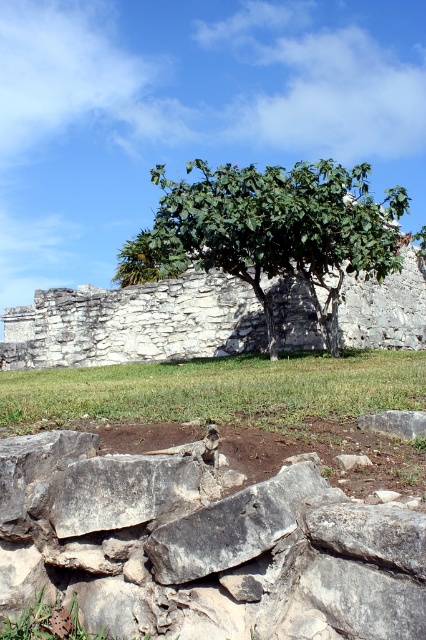
Question: Is green leafy tree at center above white stone ruins at center?

Choices:
 (A) no
 (B) yes

Answer: (B)

Question: Is gray rough stone at center smaller than white stone ruins at center?

Choices:
 (A) no
 (B) yes

Answer: (B)

Question: Can you confirm if gray rough stone at center is bigger than white stone ruins at center?

Choices:
 (A) yes
 (B) no

Answer: (B)

Question: Which point is farther to the camera?

Choices:
 (A) white stone ruins at center
 (B) gray rough stone at center

Answer: (A)

Question: Which point is farther from the camera taking this photo?

Choices:
 (A) (382, 632)
 (B) (201, 307)

Answer: (B)

Question: Which point is farther from the camera taking this photo?

Choices:
 (A) (137, 636)
 (B) (184, 326)
 (C) (377, 252)

Answer: (B)